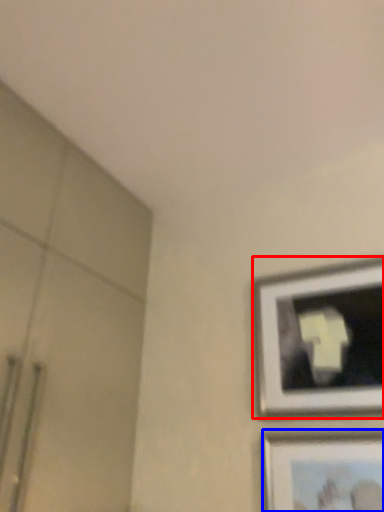
Question: Which of the following is the closest to the observer, picture frame (highlighted by a red box) or picture frame (highlighted by a blue box)?

Choices:
 (A) picture frame
 (B) picture frame

Answer: (B)